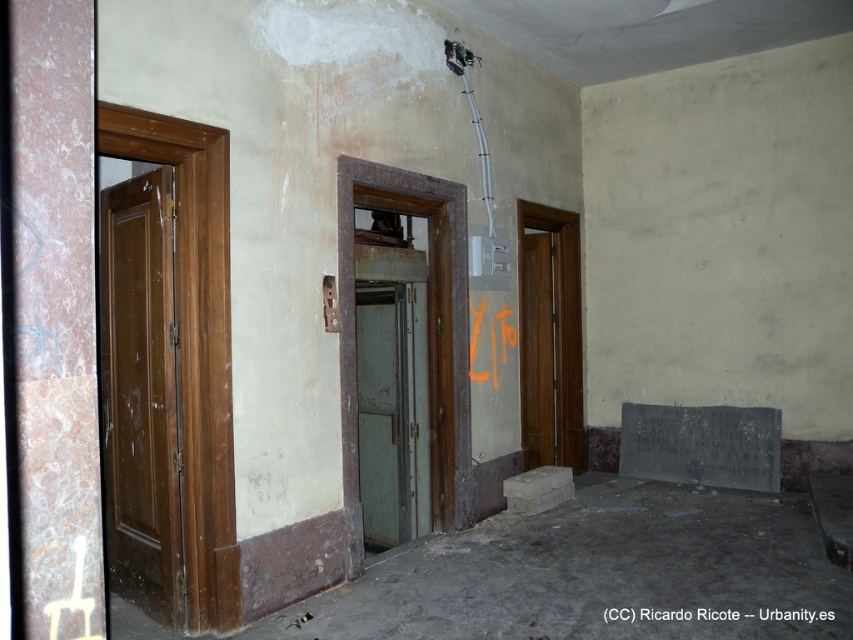
You are a painter who needs to choose between two doors to paint. The matte brown door at left and the brown wooden door at center right. Which door should you choose if you want to paint the smaller one?

The matte brown door at left is smaller than the brown wooden door at center right, so you should choose the matte brown door at left to paint the smaller one.

You are a maintenance worker trying to access the electrical panel behind the matte brown door at left and the brown wooden door at center right. Which door should you open first to reach the electrical panel located on the lower part of the wall?

The matte brown door at left is located below the brown wooden door at center right, so you should open the matte brown door at left first to access the electrical panel on the lower part of the wall.